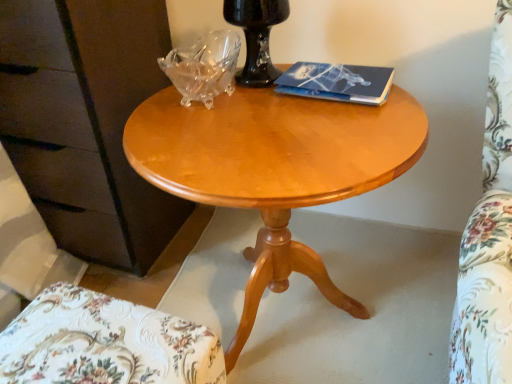
This screenshot has height=384, width=512. Find the location of `free space in front of blue matte paper at upper right`. free space in front of blue matte paper at upper right is located at coordinates (333, 125).